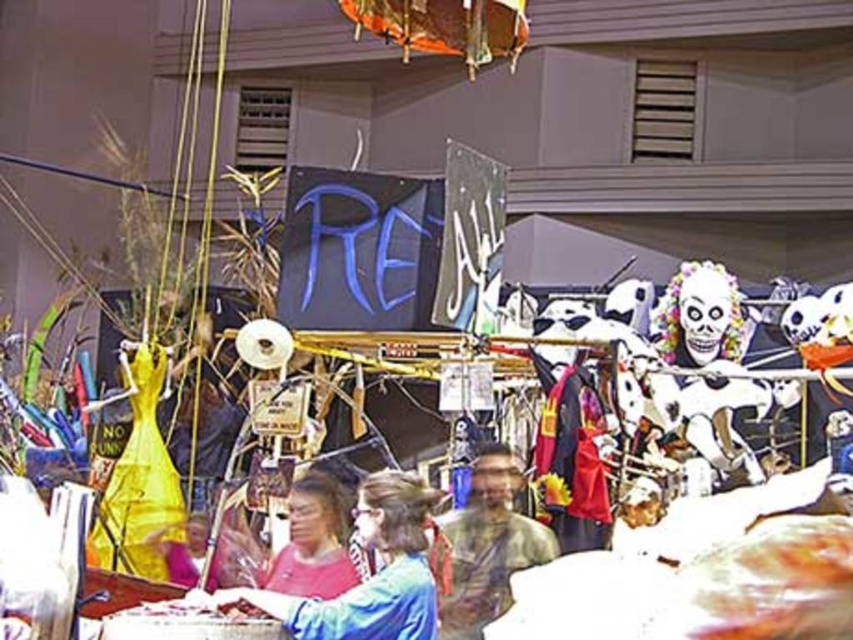
Does blue fabric shirt at center appear on the right side of camouflage-patterned shirt at center?

Incorrect, blue fabric shirt at center is not on the right side of camouflage-patterned shirt at center.

This screenshot has width=853, height=640. In order to click on blue fabric shirt at center in this screenshot , I will do `click(370, 576)`.

Can you confirm if blue fabric shirt at center is bigger than matte pink shirt at center?

Yes.

Between point (294, 621) and point (302, 483), which one is positioned behind?

Point (302, 483)

Describe the element at coordinates (370, 576) in the screenshot. I see `blue fabric shirt at center` at that location.

The width and height of the screenshot is (853, 640). In order to click on blue fabric shirt at center in this screenshot , I will do `click(370, 576)`.

Which of these two, camouflage-patterned shirt at center or matte pink shirt at center, stands taller?

With more height is camouflage-patterned shirt at center.

Is camouflage-patterned shirt at center in front of matte pink shirt at center?

No.

Where is `camouflage-patterned shirt at center`? The image size is (853, 640). camouflage-patterned shirt at center is located at coordinates (488, 545).